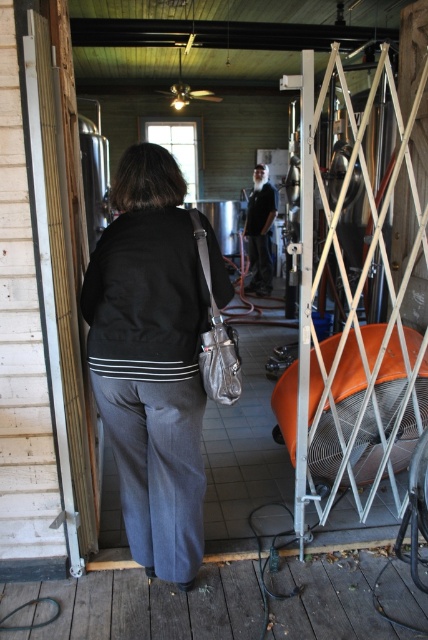
Question: Among these objects, which one is nearest to the camera?

Choices:
 (A) wooden screen door at left
 (B) black leather jacket at center

Answer: (A)

Question: Does matte black jacket at center appear under black leather jacket at center?

Choices:
 (A) yes
 (B) no

Answer: (A)

Question: Is wooden screen door at left to the right of black leather jacket at center from the viewer's perspective?

Choices:
 (A) no
 (B) yes

Answer: (A)

Question: Which object is the farthest from the matte black jacket at center?

Choices:
 (A) black leather jacket at center
 (B) wooden screen door at left

Answer: (A)

Question: Which of the following is the farthest from the observer?

Choices:
 (A) (192, 278)
 (B) (68, 499)

Answer: (B)

Question: Is matte black jacket at center positioned at the back of wooden screen door at left?

Choices:
 (A) no
 (B) yes

Answer: (B)